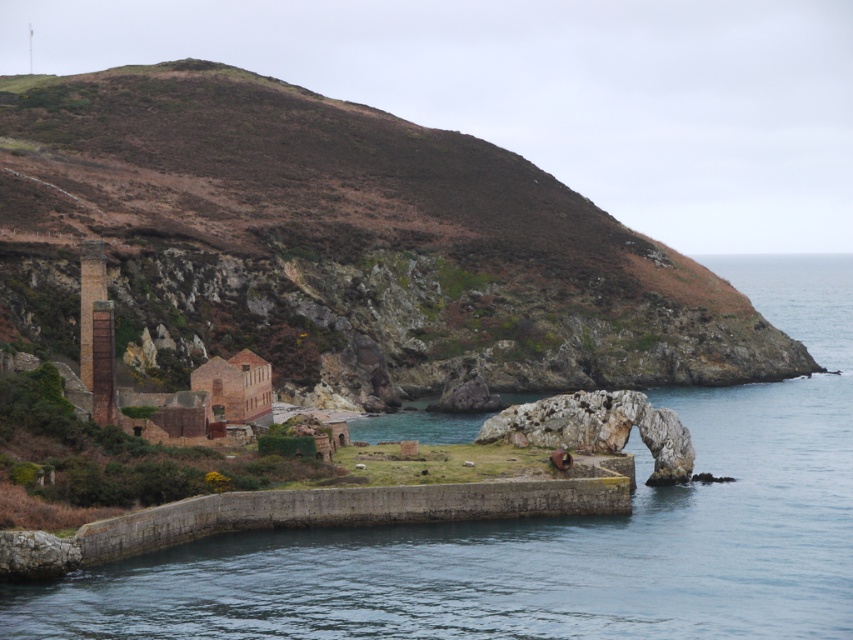
Between brown rocky hillside at upper left and concrete wall at center, which one is positioned higher?

brown rocky hillside at upper left is higher up.

Can you confirm if brown rocky hillside at upper left is positioned below concrete wall at center?

Actually, brown rocky hillside at upper left is above concrete wall at center.

Is point (483, 161) closer to camera compared to point (76, 634)?

No.

The image size is (853, 640). Identify the location of brown rocky hillside at upper left. pyautogui.click(x=337, y=248).